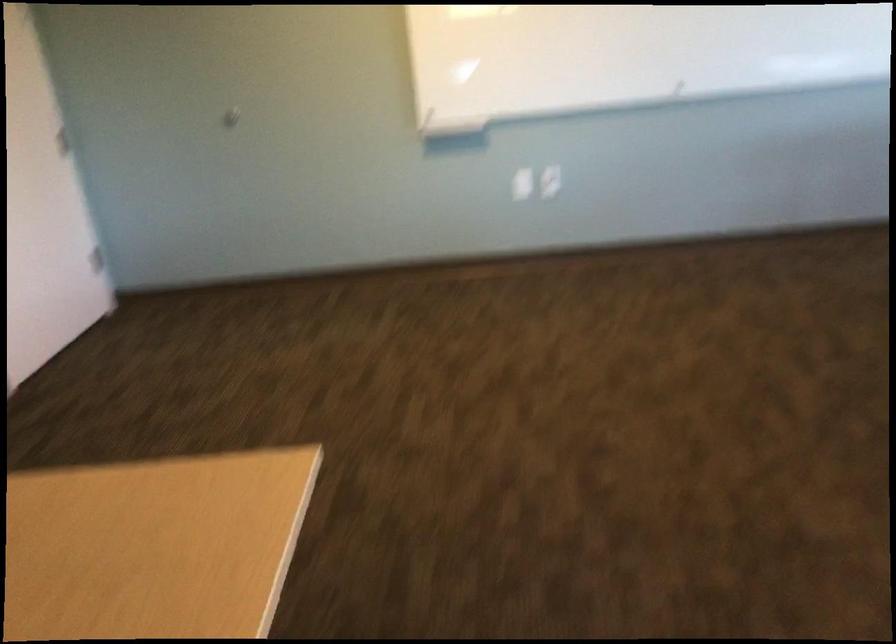
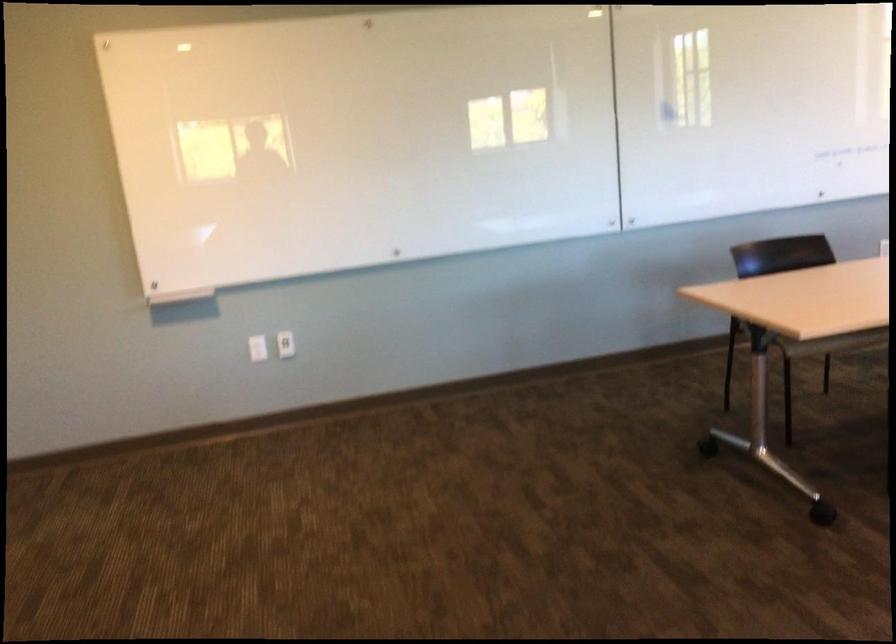
Question: The camera is either moving clockwise (left) or counter-clockwise (right) around the object. The first image is from the beginning of the video and the second image is from the end. Is the camera moving left or right when shooting the video?

Choices:
 (A) Left
 (B) Right

Answer: (A)